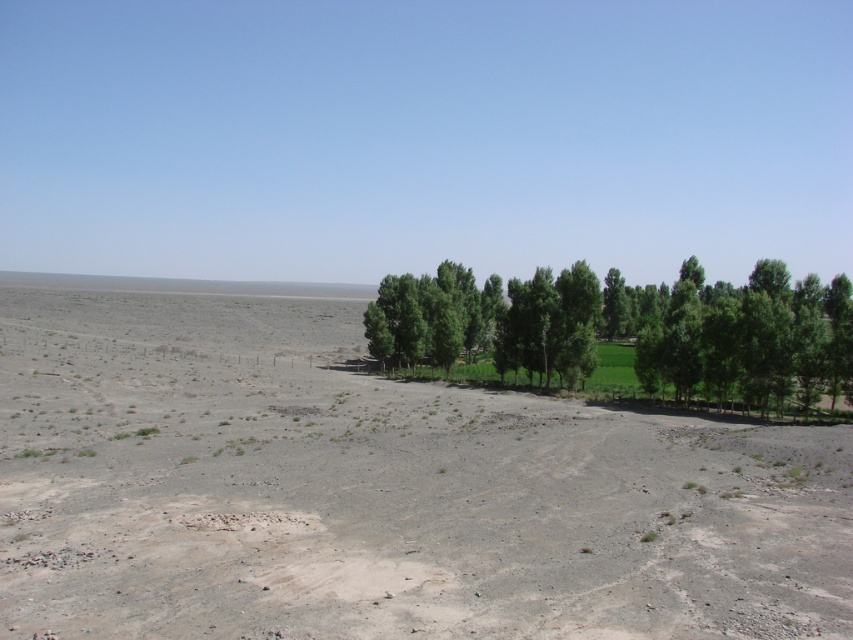
Can you confirm if gray/dry/dirt field at center is positioned to the right of green leafy trees at right?

In fact, gray/dry/dirt field at center is to the left of green leafy trees at right.

Between gray/dry/dirt field at center and green leafy trees at right, which one is positioned lower?

Positioned lower is gray/dry/dirt field at center.

Does point (412, 572) come closer to viewer compared to point (459, 339)?

Yes, point (412, 572) is in front of point (459, 339).

The image size is (853, 640). Identify the location of gray/dry/dirt field at center. (376, 488).